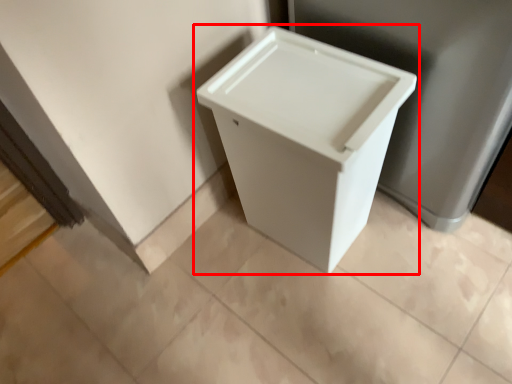
Question: Observing the image, what is the correct spatial positioning of waste container (annotated by the red box) in reference to porcelain?

Choices:
 (A) right
 (B) left

Answer: (B)